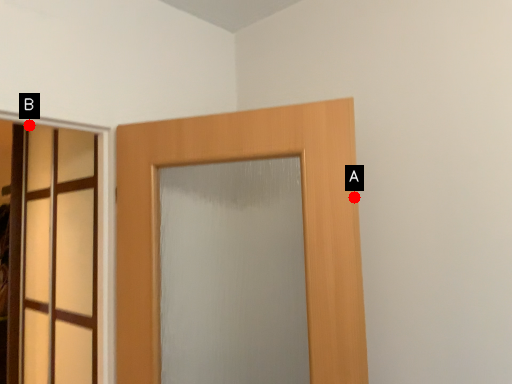
Question: Two points are circled on the image, labeled by A and B beside each circle. Which point is closer to the camera?

Choices:
 (A) A is closer
 (B) B is closer

Answer: (A)